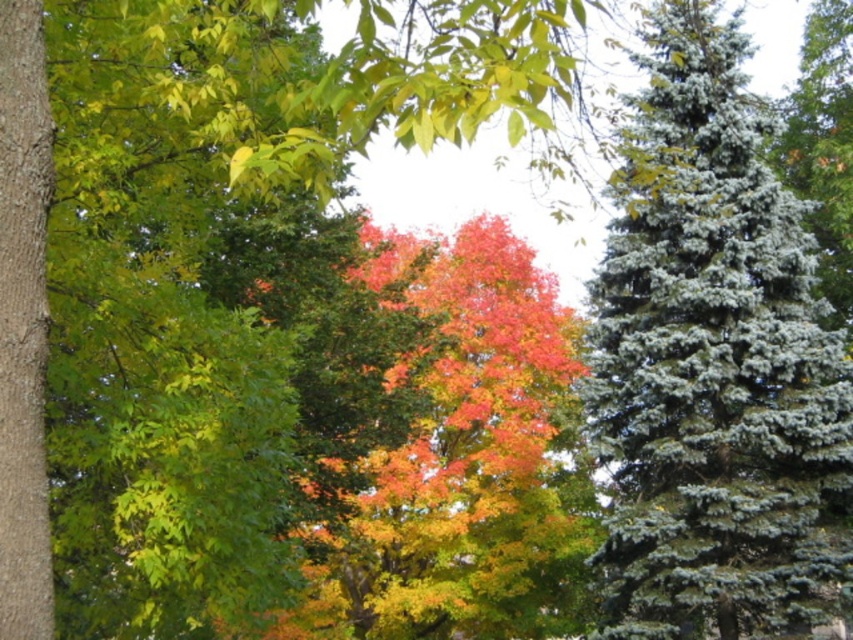
Locate an element on the screen. vivid orange leaves at center is located at coordinates (434, 429).

Does vivid orange leaves at center come behind smooth brown bark at left?

Yes, it is behind smooth brown bark at left.

Between point (561, 540) and point (12, 10), which one is positioned in front?

Positioned in front is point (12, 10).

Find the location of `vivid orange leaves at center`. vivid orange leaves at center is located at coordinates (434, 429).

Between blue-green needle-like at right and vivid orange leaves at center, which one is positioned lower?

Positioned lower is vivid orange leaves at center.

Does blue-green needle-like at right lie behind vivid orange leaves at center?

No, blue-green needle-like at right is in front of vivid orange leaves at center.

Identify the location of blue-green needle-like at right. This screenshot has height=640, width=853. (x=712, y=365).

Consider the image. Can you confirm if blue-green needle-like at right is thinner than smooth brown bark at left?

No, blue-green needle-like at right is not thinner than smooth brown bark at left.

Is blue-green needle-like at right smaller than smooth brown bark at left?

No, blue-green needle-like at right is not smaller than smooth brown bark at left.

At what (x,y) coordinates should I click in order to perform the action: click on blue-green needle-like at right. Please return your answer as a coordinate pair (x, y). This screenshot has height=640, width=853. Looking at the image, I should click on (712, 365).